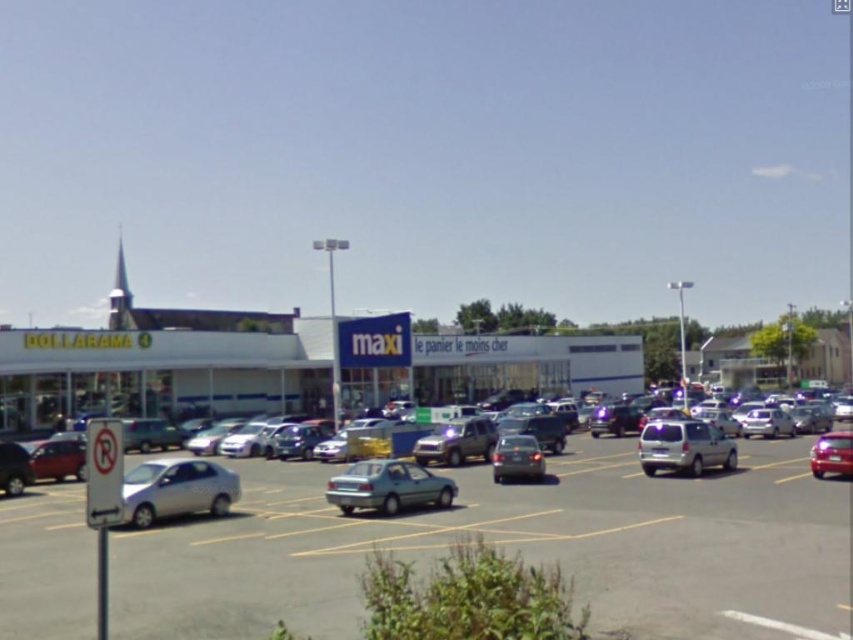
You are a delivery person trying to park your delivery van, which is 2 meters tall, in the parking lot. The parking space next to the Dollarama store is only 1.8 meters in height. Which vehicle between the silver metallic car at lower left and the metallic silver suv at center would you use as a reference to determine if your van can fit in that space?

The silver metallic car at lower left has a greater height compared to the metallic silver suv at center. Since your van is 2 meters tall and the parking space is only 1.8 meters, neither vehicle would fit. However, if you must choose a reference, the metallic silver suv at center is shorter and closer to the height limit, so it could indicate that the space is too small for your van.